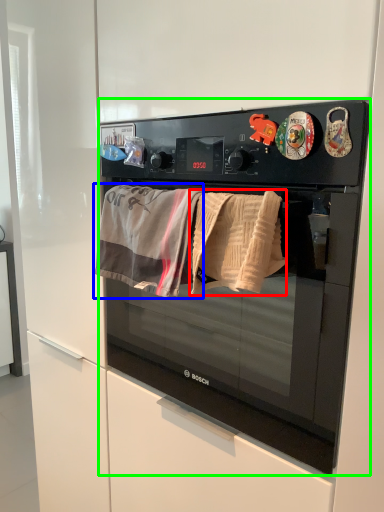
Question: Which is farther away from beach towel (highlighted by a red box)? beach towel (highlighted by a blue box) or microwave oven (highlighted by a green box)?

Choices:
 (A) beach towel
 (B) microwave oven

Answer: (B)